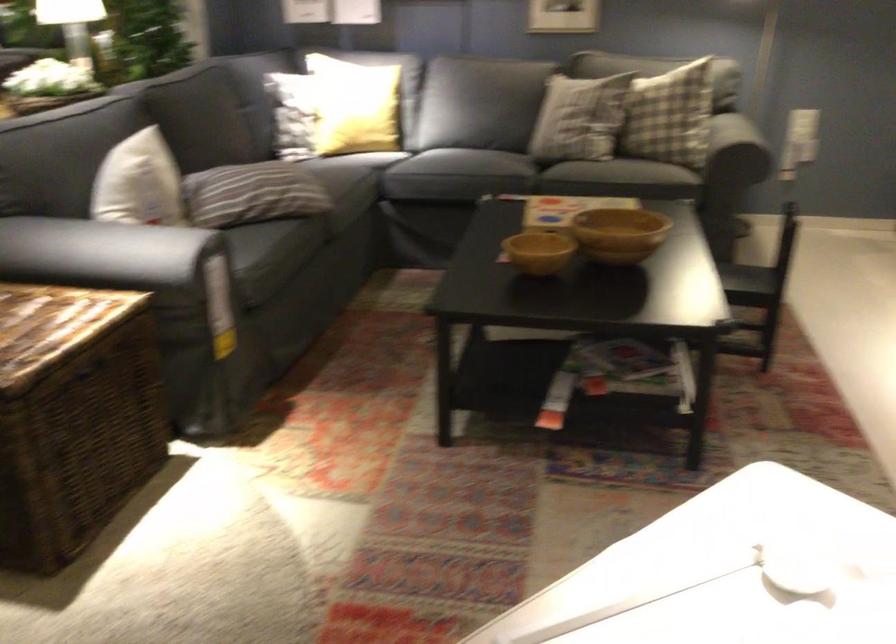
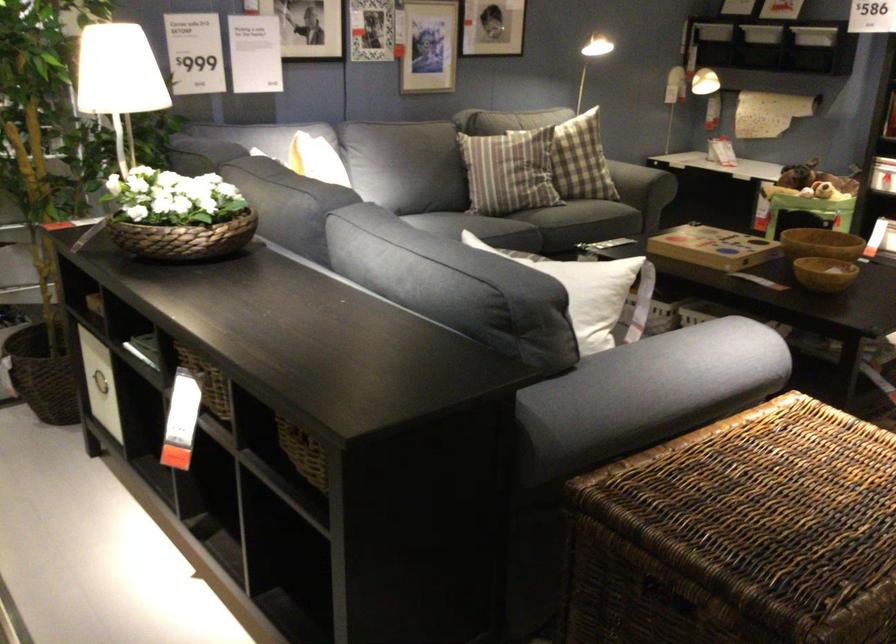
Find the pixel in the second image that matches (600,93) in the first image.

(581, 160)